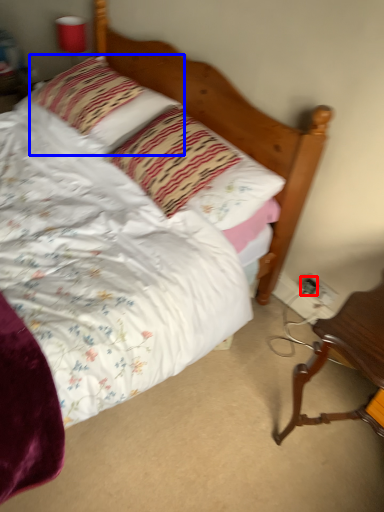
Question: Which object is further to the camera taking this photo, electric outlet (highlighted by a red box) or pillow (highlighted by a blue box)?

Choices:
 (A) electric outlet
 (B) pillow

Answer: (A)